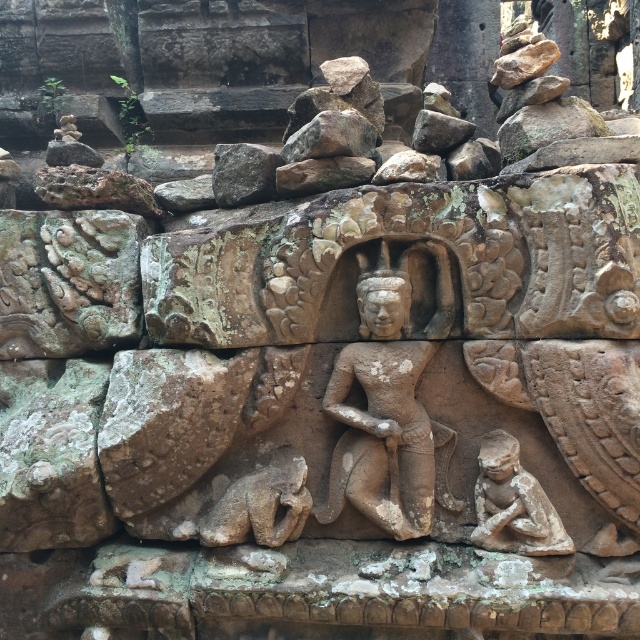
Between stone statue at center and brown stone cat at lower center, which one is positioned higher?

stone statue at center is higher up.

Can you confirm if stone statue at center is smaller than brown stone cat at lower center?

No.

Which is behind, point (420, 528) or point (209, 518)?

Point (209, 518)

Locate an element on the screen. The image size is (640, 640). stone statue at center is located at coordinates (388, 401).

Does stone statue at center have a greater width compared to rusty stone at upper center?

Yes.

Is stone statue at center to the left of rusty stone at upper center from the viewer's perspective?

In fact, stone statue at center is to the right of rusty stone at upper center.

Who is more forward, (374, 486) or (356, 125)?

Point (374, 486)

I want to click on stone statue at center, so (388, 401).

Does stone figure at lower right have a smaller size compared to rusty stone at upper center?

Indeed, stone figure at lower right has a smaller size compared to rusty stone at upper center.

Does point (513, 497) come closer to viewer compared to point (332, 134)?

Yes, it is.

The image size is (640, 640). I want to click on stone figure at lower right, so click(513, 502).